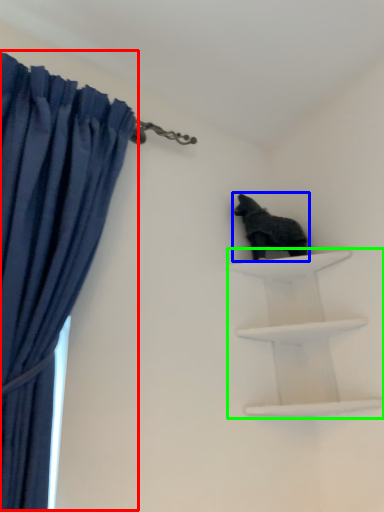
Question: Which object is positioned farthest from curtain (highlighted by a red box)? Select from animal (highlighted by a blue box) and shelf (highlighted by a green box).

Choices:
 (A) animal
 (B) shelf

Answer: (B)